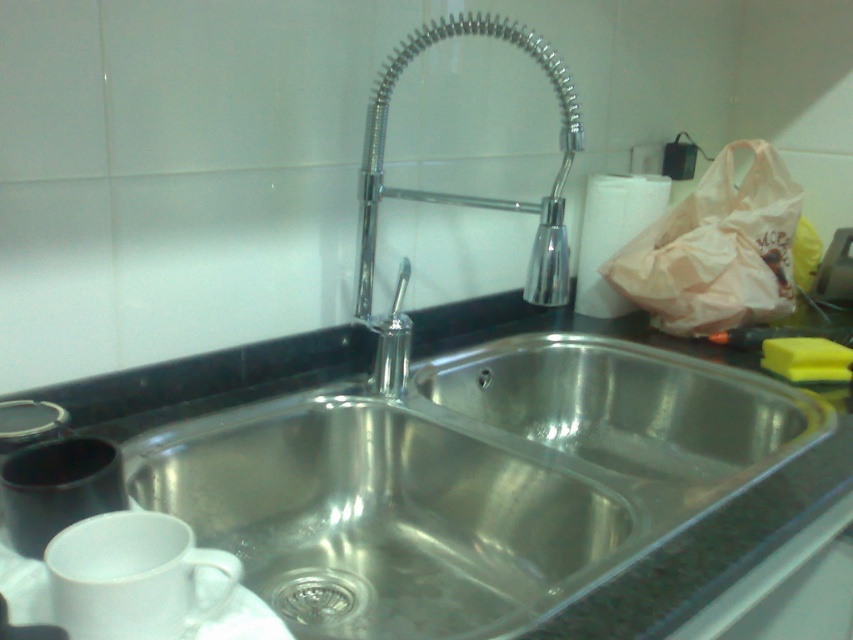
You are standing in front of the kitchen sink and want to place a small dish on the counter near the sink. Which object, the stainless steel sink at center or the brushed metal drain at center, is closer to you where you can easily reach it?

The stainless steel sink at center is closer to the viewer than the brushed metal drain at center, so you can easily reach it.

You need to place a 10 cm wide dishwashing brush in the kitchen. Based on the scene, which object between the stainless steel sink at center and the brushed metal drain at center can accommodate the brush in terms of width?

The stainless steel sink at center has a larger width than the brushed metal drain at center, so the dishwashing brush can fit into the stainless steel sink at center.